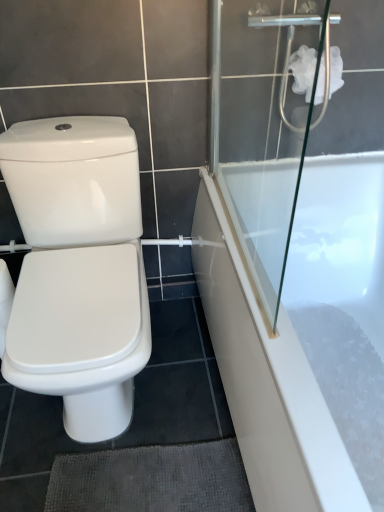
Question: Can you confirm if white glossy bidet at left is positioned to the right of white fluffy toilet paper at upper right?

Choices:
 (A) yes
 (B) no

Answer: (B)

Question: Is white glossy bidet at left turned away from white fluffy toilet paper at upper right?

Choices:
 (A) yes
 (B) no

Answer: (B)

Question: From a real-world perspective, does white glossy bidet at left sit lower than white fluffy toilet paper at upper right?

Choices:
 (A) yes
 (B) no

Answer: (A)

Question: Could you tell me if white glossy bidet at left is facing white fluffy toilet paper at upper right?

Choices:
 (A) no
 (B) yes

Answer: (A)

Question: Considering the relative positions of white glossy bidet at left and white fluffy toilet paper at upper right in the image provided, is white glossy bidet at left behind white fluffy toilet paper at upper right?

Choices:
 (A) yes
 (B) no

Answer: (B)

Question: Can you confirm if white glossy bidet at left is wider than white fluffy toilet paper at upper right?

Choices:
 (A) yes
 (B) no

Answer: (A)

Question: Is white fluffy toilet paper at upper right to the right of white glossy bathtub at right from the viewer's perspective?

Choices:
 (A) yes
 (B) no

Answer: (B)

Question: Is white fluffy toilet paper at upper right aimed at white glossy bathtub at right?

Choices:
 (A) yes
 (B) no

Answer: (B)

Question: Can we say white fluffy toilet paper at upper right lies outside white glossy bathtub at right?

Choices:
 (A) yes
 (B) no

Answer: (A)

Question: From a real-world perspective, is white fluffy toilet paper at upper right on white glossy bathtub at right?

Choices:
 (A) yes
 (B) no

Answer: (A)

Question: Is white glossy bathtub at right surrounded by white fluffy toilet paper at upper right?

Choices:
 (A) yes
 (B) no

Answer: (B)

Question: From a real-world perspective, is white fluffy toilet paper at upper right under white glossy bathtub at right?

Choices:
 (A) yes
 (B) no

Answer: (B)

Question: Is white fluffy toilet paper at upper right wider than transparent glass shower door at upper right?

Choices:
 (A) no
 (B) yes

Answer: (B)